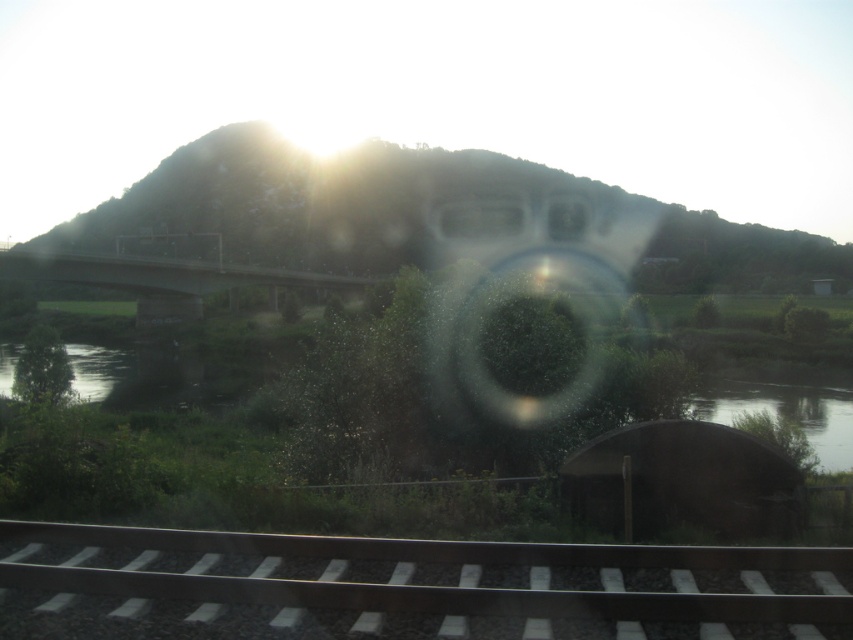
You are an architect designing a new observation deck. You need to place a transparent glass lens at center and a green concrete bridge at center. According to the scene, which object is on the right side?

The transparent glass lens at center is positioned on the right side of the green concrete bridge at center, so the transparent glass lens at center is on the right side.

You are a photographer standing in front of the window. You want to capture the railway tracks in your shot. Since the transparent glass lens at center might obstruct the view, can you adjust your position so that the smooth steel tracks at bottom center are visible without the lens blocking them?

The smooth steel tracks at bottom center are positioned on the left side of the transparent glass lens at center, so moving to the left side of the lens would allow you to see the tracks without obstruction.

You are a photographer standing in front of the window. You want to capture a photo where the smooth steel tracks at bottom center and the green concrete bridge at center are both clearly visible. Which object will appear narrower in the photo?

The smooth steel tracks at bottom center will appear narrower in the photo because they are thinner than the green concrete bridge at center.